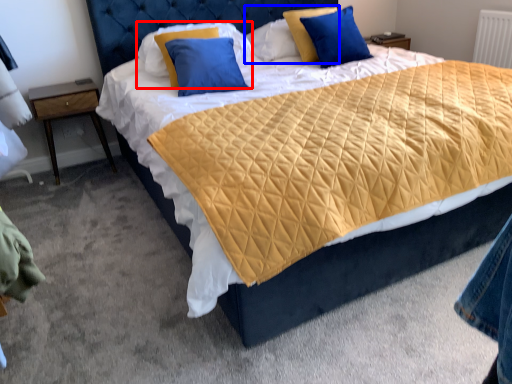
Question: Which object appears farthest to the camera in this image, pillow (highlighted by a red box) or pillow (highlighted by a blue box)?

Choices:
 (A) pillow
 (B) pillow

Answer: (B)